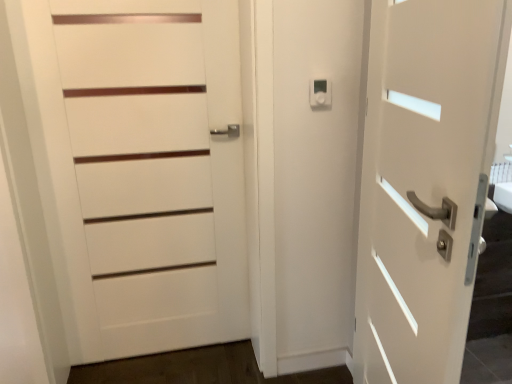
Question: Can you confirm if white plastic thermostat at upper center is positioned to the right of white matte door at left, the 1th door from the left?

Choices:
 (A) yes
 (B) no

Answer: (A)

Question: Are white plastic thermostat at upper center and white matte door at left, positioned as the second door in right-to-left order, located far from each other?

Choices:
 (A) yes
 (B) no

Answer: (B)

Question: Can white matte door at left, positioned as the second door in right-to-left order, be found inside white plastic thermostat at upper center?

Choices:
 (A) yes
 (B) no

Answer: (B)

Question: From the image's perspective, would you say white plastic thermostat at upper center is shown under white matte door at left, the 1th door from the left?

Choices:
 (A) no
 (B) yes

Answer: (A)

Question: Can you confirm if white plastic thermostat at upper center is shorter than white matte door at left, positioned as the second door in right-to-left order?

Choices:
 (A) no
 (B) yes

Answer: (B)

Question: Which is correct: white matte door at right, which is counted as the first door, starting from the right, is inside white plastic thermostat at upper center, or outside of it?

Choices:
 (A) outside
 (B) inside

Answer: (A)

Question: From a real-world perspective, is white matte door at right, positioned as the 2th door in left-to-right order, physically located above or below white plastic thermostat at upper center?

Choices:
 (A) above
 (B) below

Answer: (B)

Question: In terms of size, does white matte door at right, positioned as the 2th door in left-to-right order, appear bigger or smaller than white plastic thermostat at upper center?

Choices:
 (A) small
 (B) big

Answer: (B)

Question: Based on their positions, is white matte door at right, positioned as the 2th door in left-to-right order, located to the left or right of white plastic thermostat at upper center?

Choices:
 (A) left
 (B) right

Answer: (B)

Question: From a real-world perspective, is white matte door at left, positioned as the second door in right-to-left order, positioned above or below white plastic thermostat at upper center?

Choices:
 (A) above
 (B) below

Answer: (B)

Question: Is white matte door at left, the 1th door from the left, wider or thinner than white plastic thermostat at upper center?

Choices:
 (A) thin
 (B) wide

Answer: (B)

Question: Is point (54, 190) positioned closer to the camera than point (323, 104)?

Choices:
 (A) farther
 (B) closer

Answer: (A)

Question: Is white matte door at left, the 1th door from the left, situated inside white plastic thermostat at upper center or outside?

Choices:
 (A) inside
 (B) outside

Answer: (B)

Question: Is white matte door at left, positioned as the second door in right-to-left order, situated inside white matte door at right, positioned as the 2th door in left-to-right order, or outside?

Choices:
 (A) outside
 (B) inside

Answer: (A)

Question: From a real-world perspective, is white matte door at left, the 1th door from the left, physically located above or below white matte door at right, which is counted as the first door, starting from the right?

Choices:
 (A) above
 (B) below

Answer: (A)